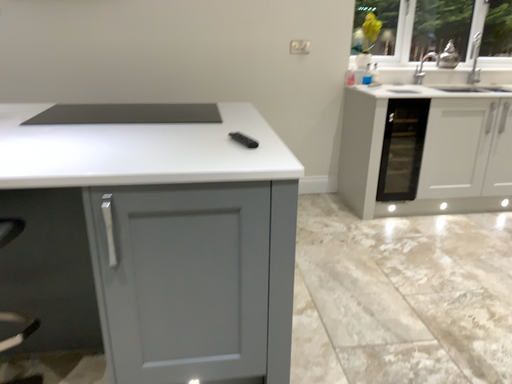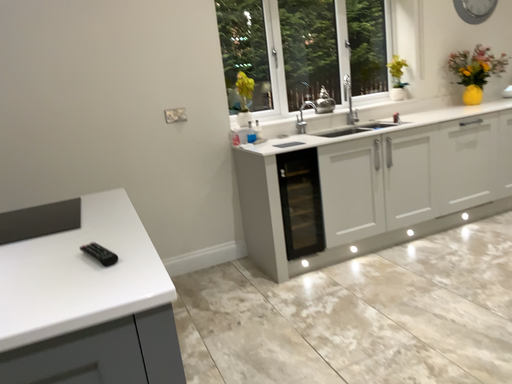
Question: How did the camera likely rotate when shooting the video?

Choices:
 (A) rotated left
 (B) rotated right

Answer: (B)